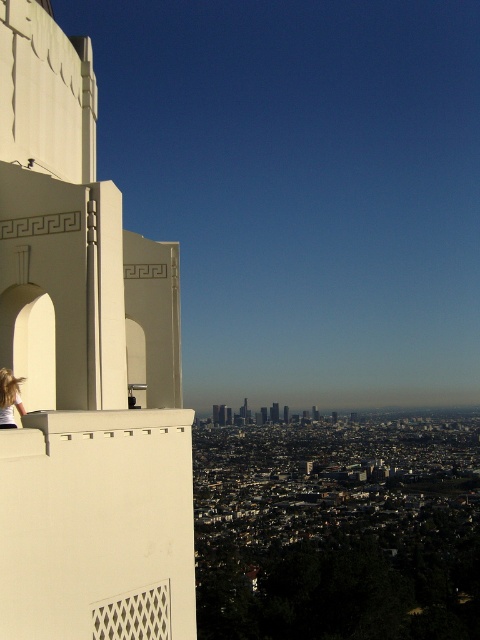
You are a drone operator trying to capture a photo of the urban landscape. You have two points marked on your screen, point [82,195] and point [276,406]. Which point is closer to your camera lens?

Point [82,195] is closer to the camera than point [276,406], so the point [82,195] is closer to the camera lens.

You are standing at the top of a tall building and looking out at the scene. You notice a person with blonde hair at left and a matte white skyscraper at center. Which object is nearer to you?

The blonde hair at left is closer to the viewer than the matte white skyscraper at center.

You are standing at the vantage point and want to take a photo of the matte white skyscraper at center without the white concrete tower at left blocking it. How should you adjust your position?

The white concrete tower at left is in front of the matte white skyscraper at center, so you should move to the right to position yourself so that the white concrete tower at left is no longer between you and the matte white skyscraper at center.